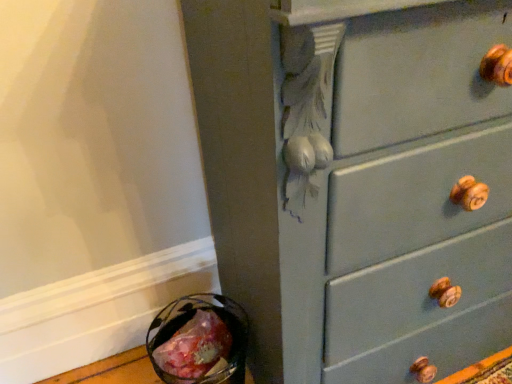
Measure the distance between point (487, 317) and camera.

They are 1.02 meters apart.

Describe the element at coordinates (359, 181) in the screenshot. The height and width of the screenshot is (384, 512). I see `matte gray dresser at center-right` at that location.

This screenshot has width=512, height=384. In order to click on matte gray dresser at center-right in this screenshot , I will do point(359,181).

Describe the element at coordinates (195, 348) in the screenshot. I see `translucent plastic bag at lower left` at that location.

At what (x,y) coordinates should I click in order to perform the action: click on translucent plastic bag at lower left. Please return your answer as a coordinate pair (x, y). The image size is (512, 384). Looking at the image, I should click on (195, 348).

Locate an element on the screen. matte gray dresser at center-right is located at coordinates (359, 181).

Between matte gray dresser at center-right and translucent plastic bag at lower left, which one appears on the left side from the viewer's perspective?

translucent plastic bag at lower left.

Considering the positions of objects matte gray dresser at center-right and translucent plastic bag at lower left in the image provided, who is in front, matte gray dresser at center-right or translucent plastic bag at lower left?

matte gray dresser at center-right is in front.

Is point (280, 125) closer or farther from the camera than point (163, 351)?

Clearly, point (280, 125) is closer to the camera than point (163, 351).

From the image's perspective, is matte gray dresser at center-right located beneath translucent plastic bag at lower left?

Incorrect, from the image's perspective, matte gray dresser at center-right is higher than translucent plastic bag at lower left.

From a real-world perspective, between matte gray dresser at center-right and translucent plastic bag at lower left, who is vertically higher?

matte gray dresser at center-right, from a real-world perspective.

Considering the relative sizes of matte gray dresser at center-right and translucent plastic bag at lower left in the image provided, is matte gray dresser at center-right thinner than translucent plastic bag at lower left?

In fact, matte gray dresser at center-right might be wider than translucent plastic bag at lower left.

In terms of height, does matte gray dresser at center-right look taller or shorter compared to translucent plastic bag at lower left?

In the image, matte gray dresser at center-right appears to be taller than translucent plastic bag at lower left.

Looking at the image, does matte gray dresser at center-right seem bigger or smaller compared to translucent plastic bag at lower left?

Clearly, matte gray dresser at center-right is larger in size than translucent plastic bag at lower left.

Would you say translucent plastic bag at lower left is part of matte gray dresser at center-right's contents?

No, translucent plastic bag at lower left is not inside matte gray dresser at center-right.

Is matte gray dresser at center-right not close to translucent plastic bag at lower left?

That's not correct — matte gray dresser at center-right is a little close to translucent plastic bag at lower left.

Is matte gray dresser at center-right positioned with its back to translucent plastic bag at lower left?

No, matte gray dresser at center-right's orientation is not away from translucent plastic bag at lower left.

How many degrees apart are the facing directions of matte gray dresser at center-right and translucent plastic bag at lower left?

They differ by 0.545 degrees in their facing directions.

Measure the distance from matte gray dresser at center-right to translucent plastic bag at lower left.

matte gray dresser at center-right is 51.17 centimeters from translucent plastic bag at lower left.

This screenshot has height=384, width=512. I want to click on the chest of drawers in front of the translucent plastic bag at lower left, so click(359, 181).

Which object is positioned more to the left, translucent plastic bag at lower left or matte gray dresser at center-right?

From the viewer's perspective, translucent plastic bag at lower left appears more on the left side.

Which is in front, translucent plastic bag at lower left or matte gray dresser at center-right?

matte gray dresser at center-right is closer to the camera.

Is point (211, 334) positioned in front of point (362, 158)?

No, it is behind (362, 158).

From the image's perspective, which one is positioned lower, translucent plastic bag at lower left or matte gray dresser at center-right?

From the image's view, translucent plastic bag at lower left is below.

From a real-world perspective, relative to matte gray dresser at center-right, is translucent plastic bag at lower left vertically above or below?

translucent plastic bag at lower left is below matte gray dresser at center-right.

Considering the sizes of objects translucent plastic bag at lower left and matte gray dresser at center-right in the image provided, who is wider, translucent plastic bag at lower left or matte gray dresser at center-right?

With larger width is matte gray dresser at center-right.

In terms of height, does translucent plastic bag at lower left look taller or shorter compared to matte gray dresser at center-right?

Considering their sizes, translucent plastic bag at lower left has less height than matte gray dresser at center-right.

From the picture: Based on their sizes in the image, would you say translucent plastic bag at lower left is bigger or smaller than matte gray dresser at center-right?

In the image, translucent plastic bag at lower left appears to be smaller than matte gray dresser at center-right.

Is matte gray dresser at center-right surrounded by translucent plastic bag at lower left?

No, translucent plastic bag at lower left does not contain matte gray dresser at center-right.

In the scene shown: Is translucent plastic bag at lower left far from matte gray dresser at center-right?

No.

Is translucent plastic bag at lower left positioned with its back to matte gray dresser at center-right?

translucent plastic bag at lower left does not have its back to matte gray dresser at center-right.

At what (x,y) coordinates should I click in order to perform the action: click on food that is under the matte gray dresser at center-right (from a real-world perspective). Please return your answer as a coordinate pair (x, y). The height and width of the screenshot is (384, 512). Looking at the image, I should click on (195, 348).

This screenshot has width=512, height=384. Find the location of `the chest of drawers above the translucent plastic bag at lower left (from a real-world perspective)`. the chest of drawers above the translucent plastic bag at lower left (from a real-world perspective) is located at coordinates (359, 181).

Where is `the chest of drawers lying above the translucent plastic bag at lower left (from the image's perspective)`? the chest of drawers lying above the translucent plastic bag at lower left (from the image's perspective) is located at coordinates (359, 181).